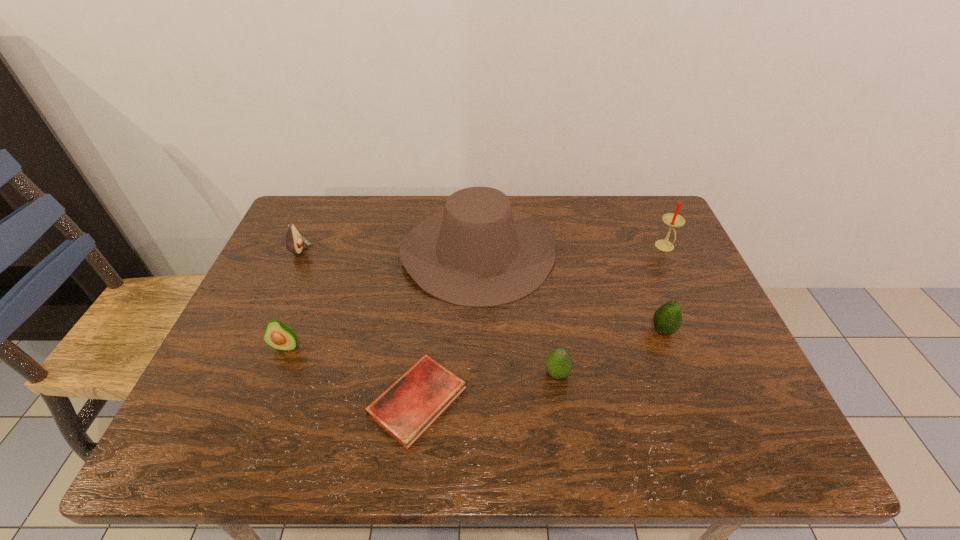
You are a GUI agent. You are given a task and a screenshot of the screen. Output one action in this format:
    pyautogui.click(x=<x>, y=<y>)
    Task: Click on the empty space between the second avocado from right to left and the leftmost avocado
    
    Given the screenshot: What is the action you would take?
    (429, 312)

You are a GUI agent. You are given a task and a screenshot of the screen. Output one action in this format:
    pyautogui.click(x=<x>, y=<y>)
    Task: Click on the vacant space that's between the shortest object and the leftmost object
    
    Given the screenshot: What is the action you would take?
    pyautogui.click(x=359, y=325)

Image resolution: width=960 pixels, height=540 pixels. What are the coordinates of `free spot between the leftmost object and the third avocado from left to right` in the screenshot? It's located at (429, 312).

Identify the location of unoccupied position between the cowboy hat and the second object from right to left. The height and width of the screenshot is (540, 960). (570, 291).

I want to click on empty location between the rightmost avocado and the cowboy hat, so click(570, 291).

Image resolution: width=960 pixels, height=540 pixels. I want to click on unoccupied position between the farthest avocado and the cowboy hat, so click(390, 250).

Locate an element on the screen. The height and width of the screenshot is (540, 960). free space that is in between the diary and the candle is located at coordinates (541, 323).

Find the location of `vacant space that's between the shortest object and the leftmost object`. vacant space that's between the shortest object and the leftmost object is located at coordinates (359, 325).

Identify which object is located as the sixth nearest to the leftmost object. Please provide its 2D coordinates. Your answer should be formatted as a tuple, i.e. [(x, y)], where the tuple contains the x and y coordinates of a point satisfying the conditions above.

[(673, 220)]

Identify the location of object that is the third closest one to the diary. This screenshot has width=960, height=540. (280, 336).